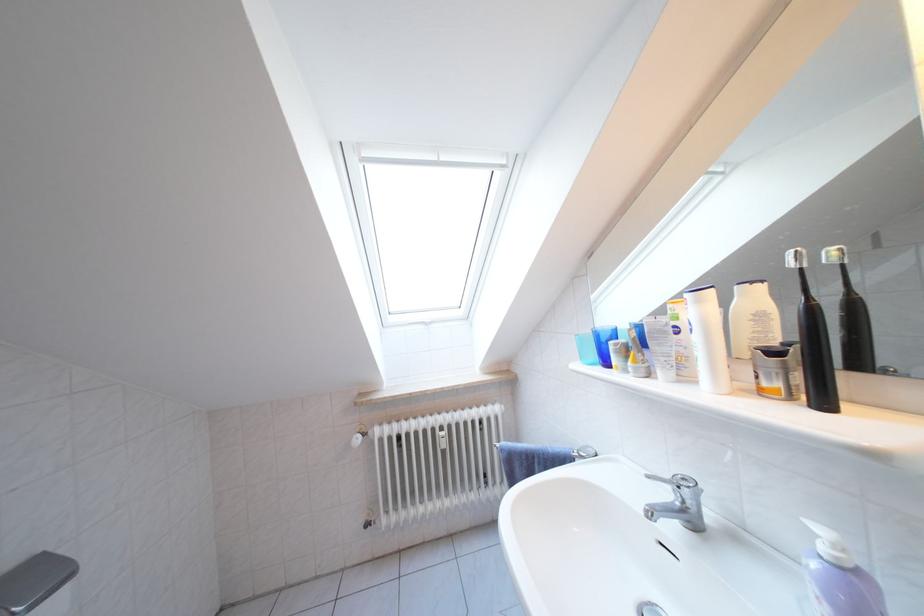
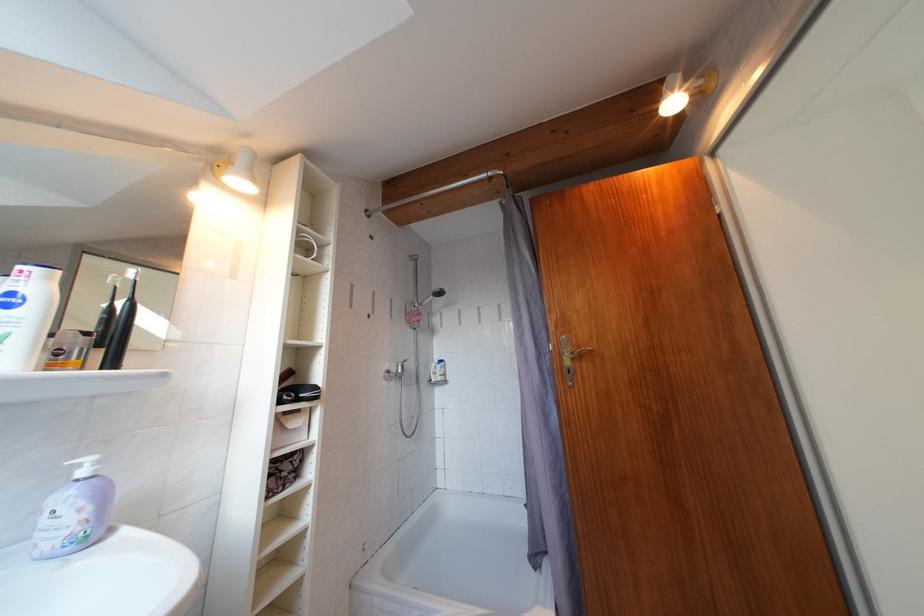
Locate, in the second image, the point that corresponds to the point at 832,554 in the first image.

(92, 477)